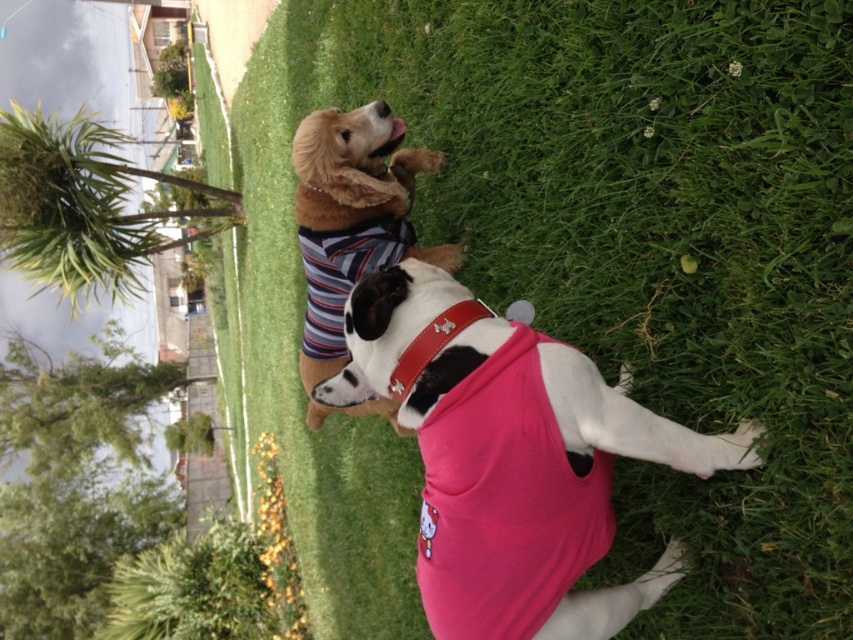
Is pink fabric dog at center to the right of striped fabric dog at upper left from the viewer's perspective?

Correct, you'll find pink fabric dog at center to the right of striped fabric dog at upper left.

I want to click on pink fabric dog at center, so click(x=509, y=458).